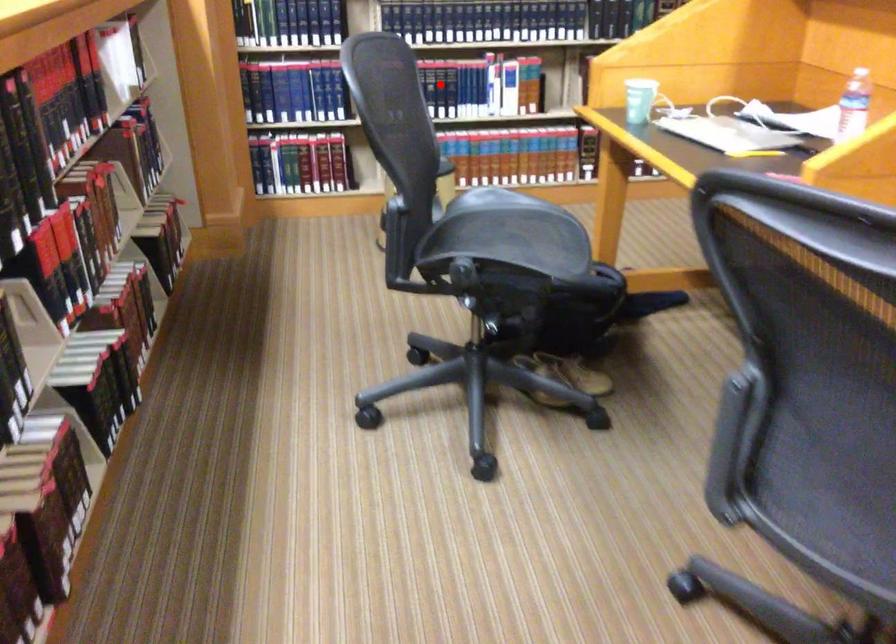
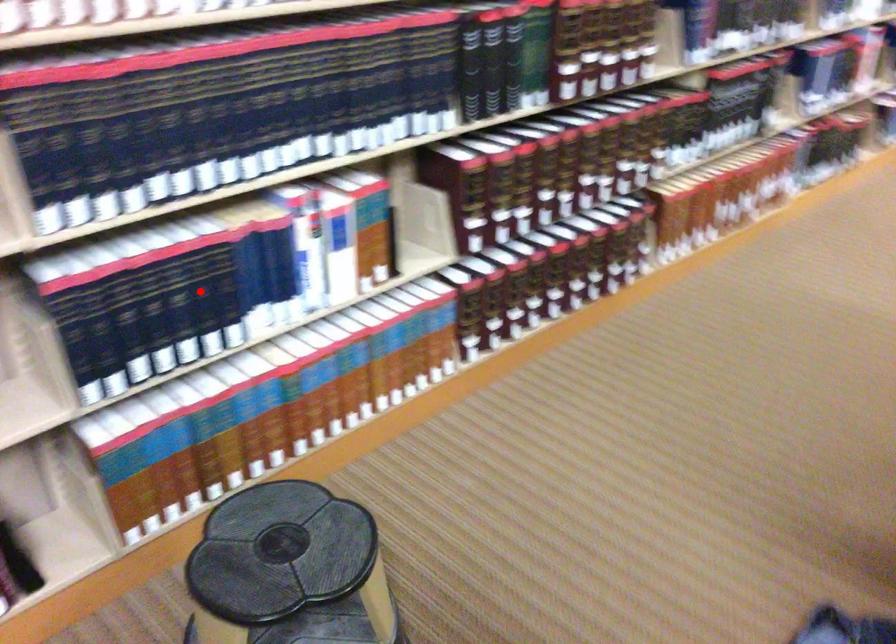
I am providing you with two images of the same scene from different viewpoints. A red point is marked on the first image and another point is marked on the second image. Do the highlighted points in image1 and image2 indicate the same real-world spot?

Yes